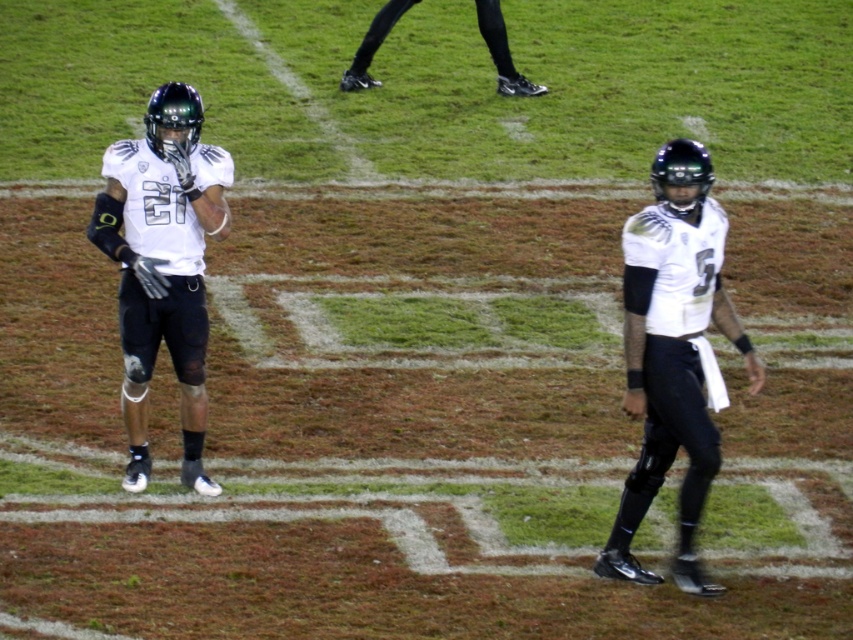
Question: Can you confirm if white matte jersey at center is positioned above matte black jersey at left?

Choices:
 (A) yes
 (B) no

Answer: (B)

Question: Which object is farther from the camera taking this photo?

Choices:
 (A) white matte jersey at center
 (B) matte black jersey at left

Answer: (B)

Question: Is white matte jersey at center positioned at the back of matte black jersey at left?

Choices:
 (A) yes
 (B) no

Answer: (B)

Question: Considering the real-world distances, which object is closest to the matte black jersey at left?

Choices:
 (A) white matte jersey at center
 (B) black synthetic shoe at upper center

Answer: (A)

Question: Does white matte jersey at center appear on the right side of matte black jersey at left?

Choices:
 (A) yes
 (B) no

Answer: (A)

Question: Which object appears farthest from the camera in this image?

Choices:
 (A) black synthetic shoe at upper center
 (B) matte black jersey at left
 (C) white matte jersey at center

Answer: (A)